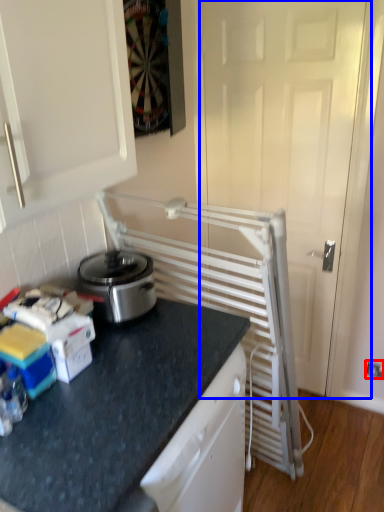
Question: Which object is further to the camera taking this photo, electric outlet (highlighted by a red box) or screen door (highlighted by a blue box)?

Choices:
 (A) electric outlet
 (B) screen door

Answer: (A)